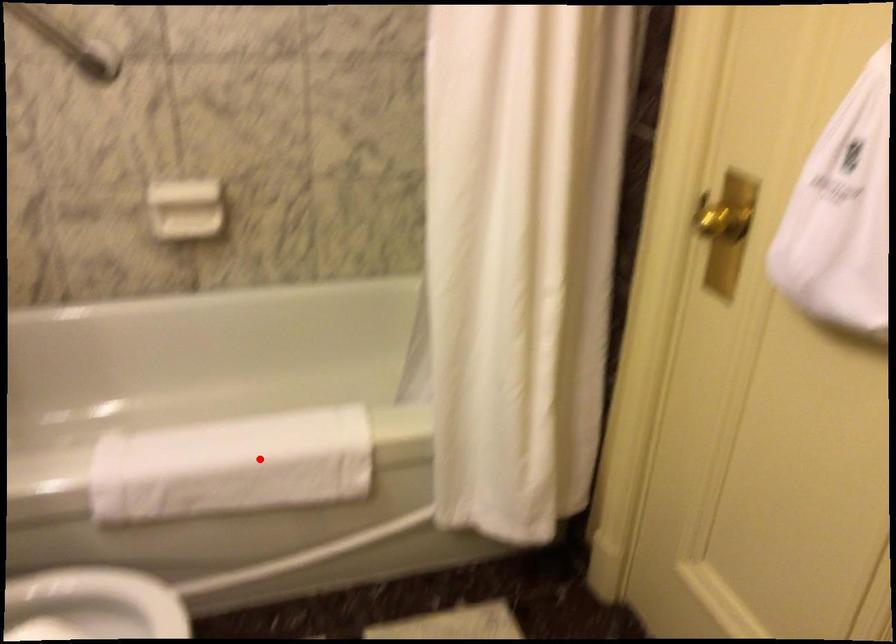
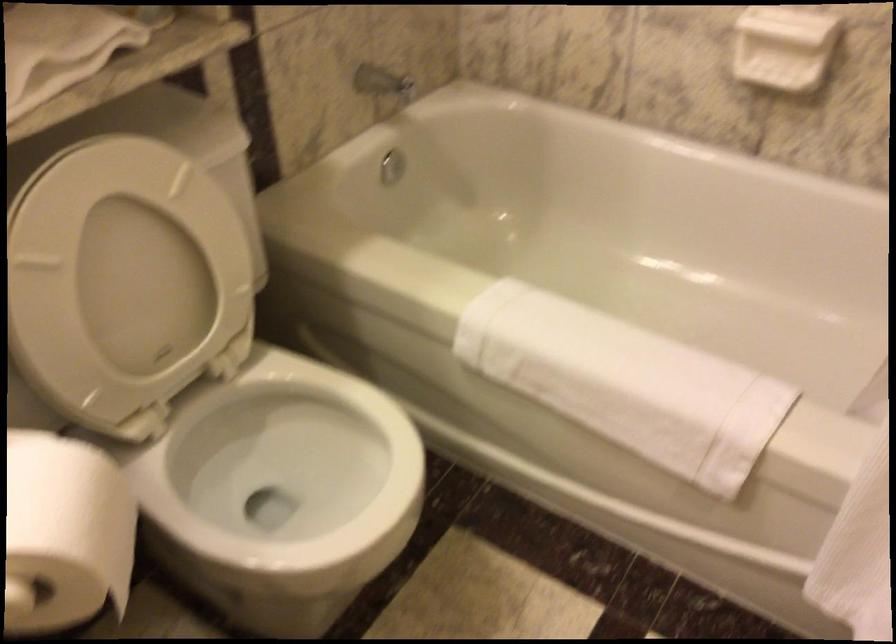
Question: I am providing you with two images of the same scene from different viewpoints. In image1, a red point is highlighted. Considering the same 3D point in image2, which of the following is correct?

Choices:
 (A) It is closer
 (B) It is farther

Answer: (A)